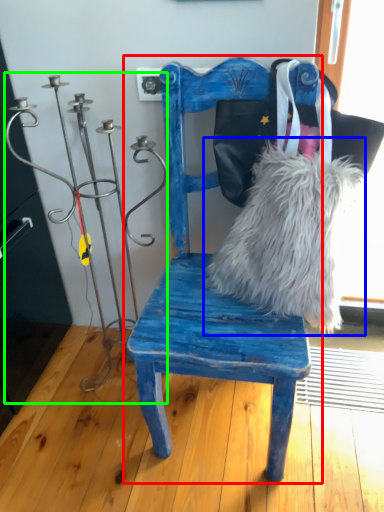
Question: Estimate the real-world distances between objects in this image. Which object is closer to chair (highlighted by a red box), fur (highlighted by a blue box) or candle holder (highlighted by a green box)?

Choices:
 (A) fur
 (B) candle holder

Answer: (A)